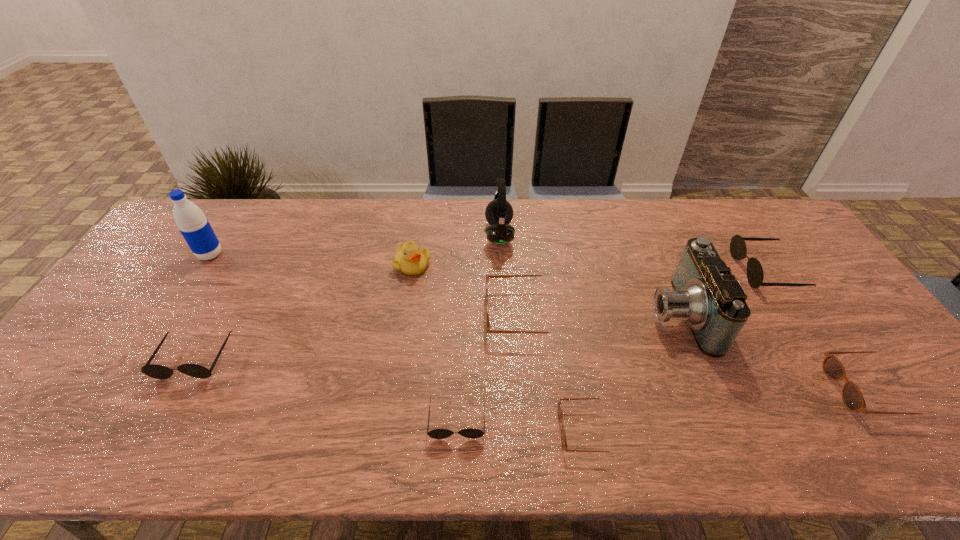
In the image, there is a desktop. Identify the location of blank space at the far edge. Image resolution: width=960 pixels, height=540 pixels. (624, 207).

The width and height of the screenshot is (960, 540). In the image, there is a desktop. Find the location of `free space at the near edge`. free space at the near edge is located at coordinates (348, 428).

The width and height of the screenshot is (960, 540). In the image, there is a desktop. What are the coordinates of `vacant space at the right edge` in the screenshot? It's located at (801, 267).

This screenshot has height=540, width=960. I want to click on free space at the far right corner of the desktop, so click(x=741, y=200).

You are a GUI agent. You are given a task and a screenshot of the screen. Output one action in this format:
    pyautogui.click(x=<x>, y=<y>)
    Task: Click on the vacant point at the near right corner
    The image size is (960, 540).
    Given the screenshot: What is the action you would take?
    pyautogui.click(x=945, y=426)

At what (x,y) coordinates should I click in order to perform the action: click on vacant space in between the farthest brown sunglasses and the smallest brown sunglasses. Please return your answer as a coordinate pair (x, y). The height and width of the screenshot is (540, 960). Looking at the image, I should click on (556, 372).

Identify the location of vacant area between the smallest brown sunglasses and the biggest black sunglasses. Image resolution: width=960 pixels, height=540 pixels. coord(677,350).

Where is `unoccupied position between the black headset and the tallest object`? Image resolution: width=960 pixels, height=540 pixels. unoccupied position between the black headset and the tallest object is located at coordinates (355, 245).

You are a GUI agent. You are given a task and a screenshot of the screen. Output one action in this format:
    pyautogui.click(x=<x>, y=<y>)
    Task: Click on the free area in between the duckling and the biggest brown sunglasses
    The width and height of the screenshot is (960, 540).
    Given the screenshot: What is the action you would take?
    pyautogui.click(x=468, y=289)

Where is `free space between the black headset and the tallest object`? free space between the black headset and the tallest object is located at coordinates (355, 245).